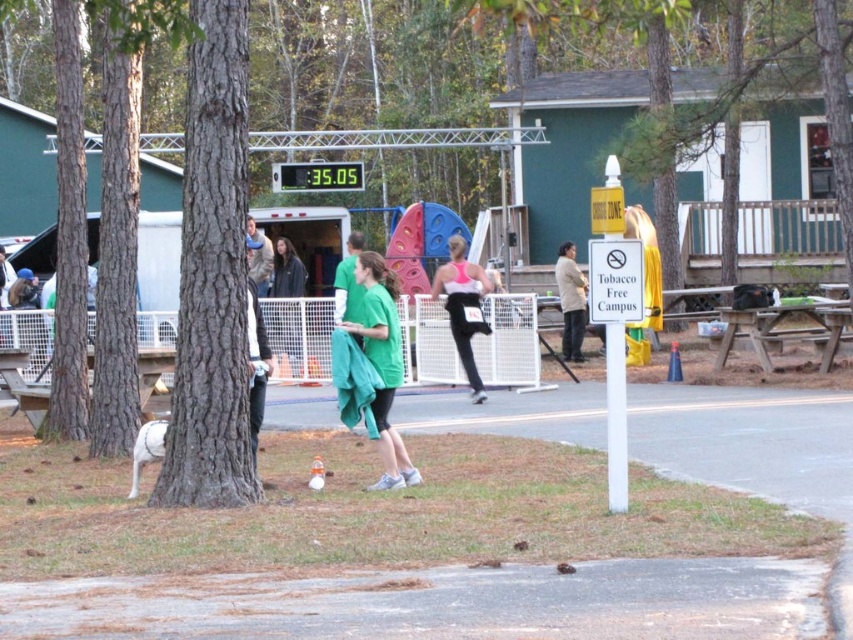
Question: Which object is the farthest from the tan fabric jacket at center?

Choices:
 (A) green fabric shirt at center
 (B) wooden picnic table at right
 (C) brown rough tree trunk at center

Answer: (C)

Question: Can you confirm if brown rough tree trunk at center is positioned above wooden picnic table at right?

Choices:
 (A) yes
 (B) no

Answer: (A)

Question: Which object is the closest to the brown rough tree at left?

Choices:
 (A) green fabric shirt at center
 (B) green fabric at center
 (C) tan fabric jacket at center

Answer: (A)

Question: Does wooden picnic table at right have a greater width compared to green fabric at center?

Choices:
 (A) yes
 (B) no

Answer: (A)

Question: Which object is farther from the camera taking this photo?

Choices:
 (A) green matte shirt at center
 (B) tan fabric jacket at center

Answer: (B)

Question: Does brown rough tree trunk at center appear on the left side of green fabric shirt at center?

Choices:
 (A) no
 (B) yes

Answer: (A)